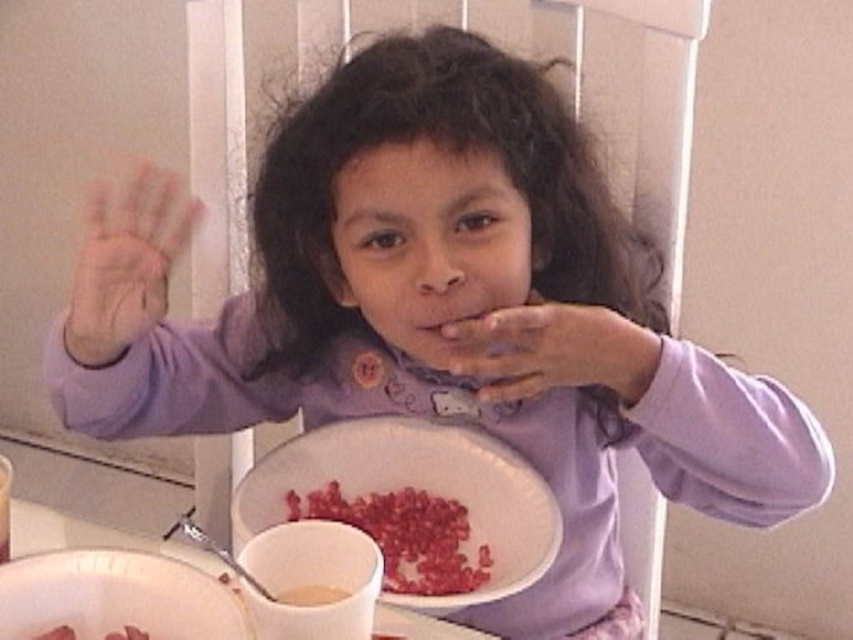
In the scene shown: Who is more distant from viewer, (148, 205) or (59, 518)?

Positioned behind is point (148, 205).

Is point (128, 212) positioned before point (96, 529)?

Yes, it is in front of point (96, 529).

Is point (164, 268) positioned in front of point (28, 538)?

No.

At what (x,y) coordinates should I click in order to perform the action: click on matte skin hand at upper left. Please return your answer as a coordinate pair (x, y). The image size is (853, 640). Looking at the image, I should click on (126, 260).

Which is more to the left, smooth red cereal at center or white matte spoon at lower center?

From the viewer's perspective, white matte spoon at lower center appears more on the left side.

Is point (384, 563) positioned before point (341, 592)?

That is False.

Find the location of `smooth red cereal at center`. smooth red cereal at center is located at coordinates (404, 536).

Can you confirm if white paper plate at lower center is positioned above matte skin hand at upper left?

Actually, white paper plate at lower center is below matte skin hand at upper left.

Between white paper plate at lower center and matte skin hand at upper left, which one appears on the left side from the viewer's perspective?

From the viewer's perspective, matte skin hand at upper left appears more on the left side.

This screenshot has width=853, height=640. I want to click on white paper plate at lower center, so click(419, 488).